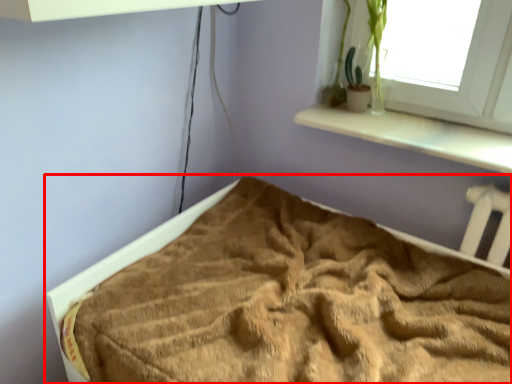
Question: From the image, what is the correct spatial relationship of bed (annotated by the red box) in relation to plant?

Choices:
 (A) right
 (B) left

Answer: (B)